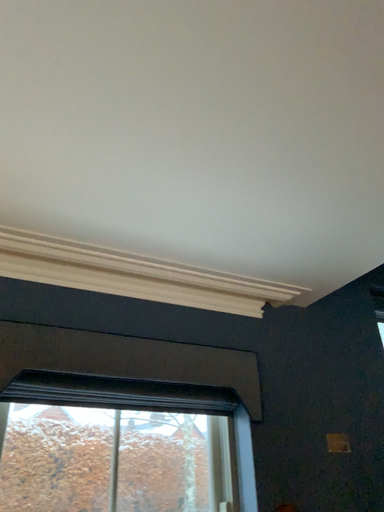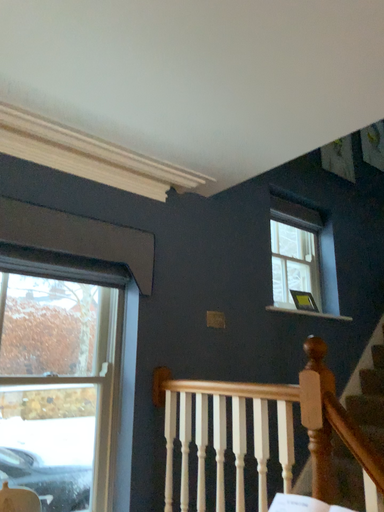
Question: How did the camera likely rotate when shooting the video?

Choices:
 (A) rotated upward
 (B) rotated downward

Answer: (B)